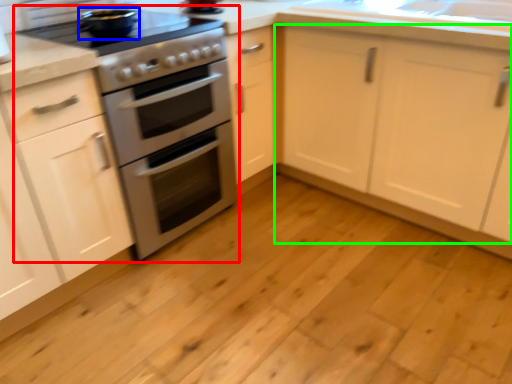
Question: Which object is the farthest from appliance (highlighted by a red box)? Choose among these: appliance (highlighted by a blue box) or cabinetry (highlighted by a green box).

Choices:
 (A) appliance
 (B) cabinetry

Answer: (B)